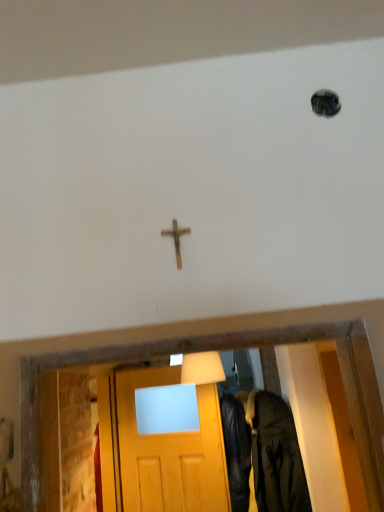
Question: Choose the correct answer: Is leather jacket at lower right inside wooden cross at center or outside it?

Choices:
 (A) outside
 (B) inside

Answer: (A)

Question: In terms of size, does leather jacket at lower right appear bigger or smaller than wooden cross at center?

Choices:
 (A) big
 (B) small

Answer: (A)

Question: From a real-world perspective, is leather jacket at lower right positioned above or below wooden cross at center?

Choices:
 (A) below
 (B) above

Answer: (A)

Question: Is point (188, 227) positioned closer to the camera than point (251, 495)?

Choices:
 (A) closer
 (B) farther

Answer: (A)

Question: From a real-world perspective, is wooden cross at center positioned above or below leather jacket at lower right?

Choices:
 (A) above
 (B) below

Answer: (A)

Question: Looking at their shapes, would you say wooden cross at center is wider or thinner than leather jacket at lower right?

Choices:
 (A) thin
 (B) wide

Answer: (A)

Question: From their relative heights in the image, would you say wooden cross at center is taller or shorter than leather jacket at lower right?

Choices:
 (A) tall
 (B) short

Answer: (B)